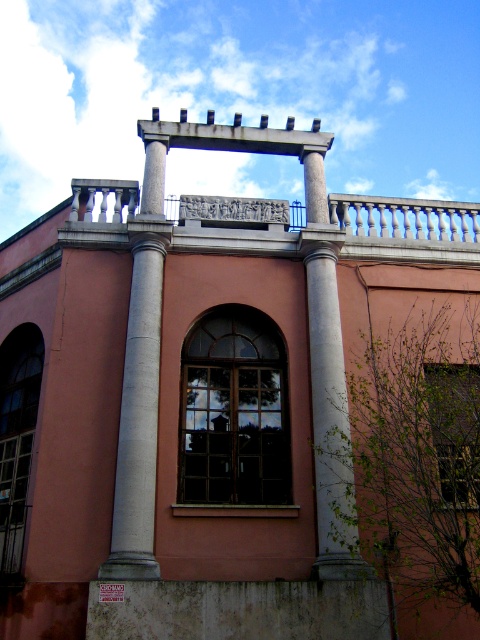
Question: Can you confirm if clear glass window at lower left is bigger than transparent glass window at center?

Choices:
 (A) no
 (B) yes

Answer: (B)

Question: Which point is closer to the camera?

Choices:
 (A) (146, 244)
 (B) (279, 220)

Answer: (A)

Question: Can you confirm if matte glass window at center is wider than gray stone balustrade at center?

Choices:
 (A) yes
 (B) no

Answer: (B)

Question: Which point appears farthest from the camera in this image?

Choices:
 (A) (478, 481)
 (B) (29, 397)

Answer: (B)

Question: Based on their relative distances, which object is farther from the transparent glass window at center?

Choices:
 (A) gray polished stone column at left
 (B) smooth concrete column at center
 (C) clear glass window at lower left
 (D) matte glass window at center

Answer: (C)

Question: Considering the relative positions of gray stone balustrade at center and clear glass window at lower left in the image provided, where is gray stone balustrade at center located with respect to clear glass window at lower left?

Choices:
 (A) below
 (B) above

Answer: (B)